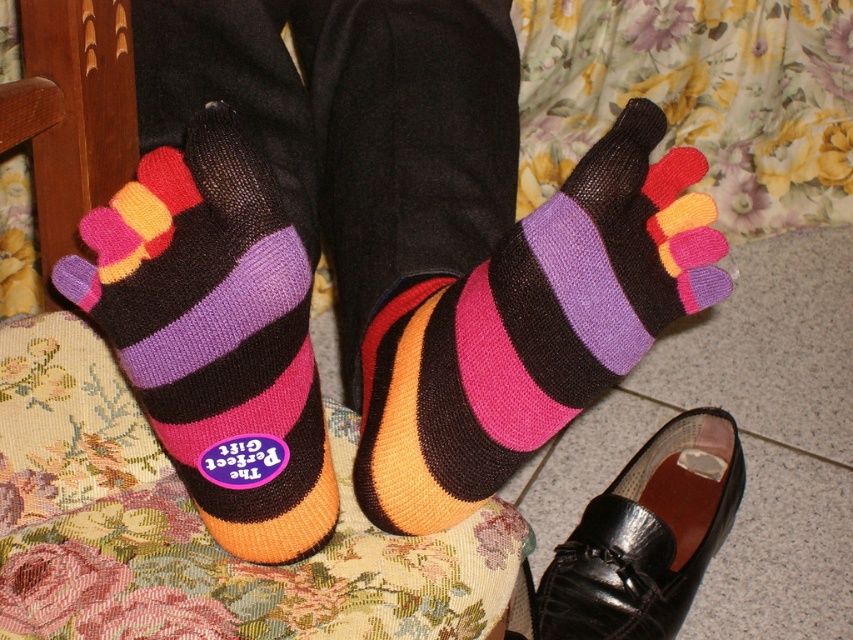
Between point (477, 417) and point (160, 268), which one is positioned in front?

Point (160, 268)

Is point (517, 336) behind point (289, 456)?

No, it is in front of (289, 456).

This screenshot has height=640, width=853. I want to click on knitted striped sock at center, so click(531, 328).

Which is below, multicolored knitted sock at center or black leather shoe at lower right?

black leather shoe at lower right is below.

Does multicolored knitted sock at center have a smaller size compared to black leather shoe at lower right?

Correct, multicolored knitted sock at center occupies less space than black leather shoe at lower right.

In order to click on multicolored knitted sock at center in this screenshot , I will do `click(216, 336)`.

Consider the image. Which is below, knitted striped sock at center or black leather shoe at lower right?

black leather shoe at lower right

Who is higher up, knitted striped sock at center or black leather shoe at lower right?

knitted striped sock at center is above.

Locate an element on the screen. The image size is (853, 640). knitted striped sock at center is located at coordinates (531, 328).